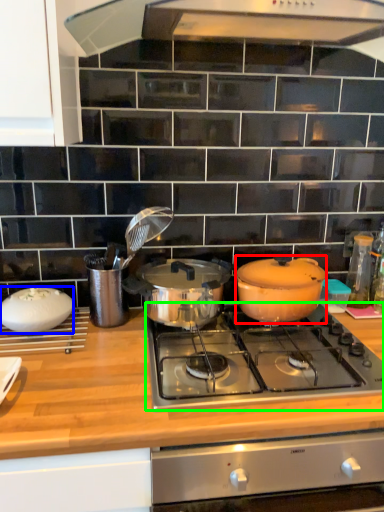
Question: Considering the real-world distances, which object is closest to pot/pan (highlighted by a red box)? kitchen appliance (highlighted by a blue box) or gas stove (highlighted by a green box).

Choices:
 (A) kitchen appliance
 (B) gas stove

Answer: (B)